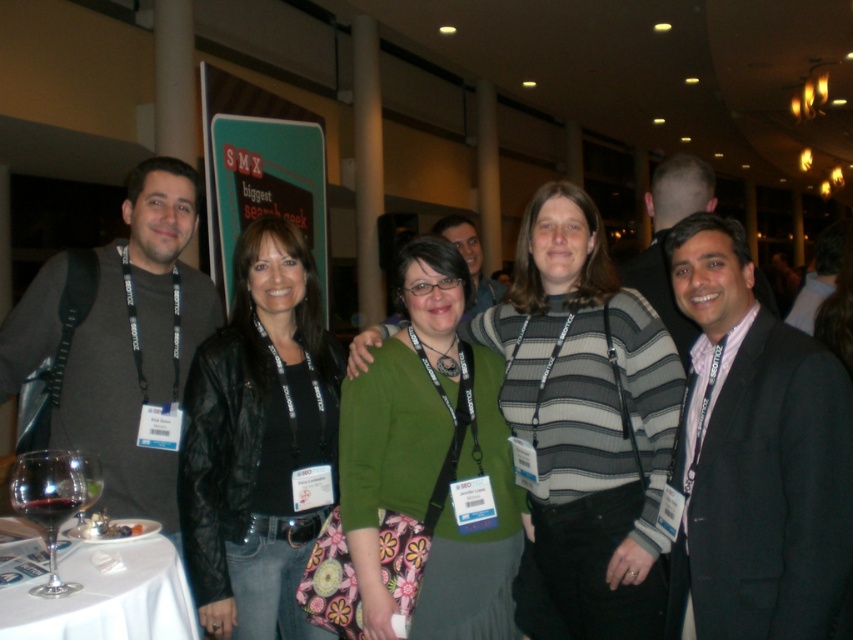
Describe the element at coordinates (258, 440) in the screenshot. I see `black leather jacket at left` at that location.

Does black leather jacket at left have a greater width compared to green fabric sweater at center?

Incorrect, black leather jacket at left's width does not surpass green fabric sweater at center's.

Which is behind, point (316, 369) or point (439, 314)?

Positioned behind is point (316, 369).

The height and width of the screenshot is (640, 853). I want to click on black leather jacket at left, so click(x=258, y=440).

Who is positioned more to the left, white cloth table at lower left or transparent glass at lower left?

Positioned to the left is transparent glass at lower left.

Which is above, white cloth table at lower left or transparent glass at lower left?

transparent glass at lower left is higher up.

Where is `white cloth table at lower left`? white cloth table at lower left is located at coordinates (107, 596).

Locate an element on the screen. The height and width of the screenshot is (640, 853). white cloth table at lower left is located at coordinates (107, 596).

Which is behind, point (666, 332) or point (80, 456)?

The point (666, 332) is more distant.

The width and height of the screenshot is (853, 640). I want to click on striped knit sweater at center, so click(585, 422).